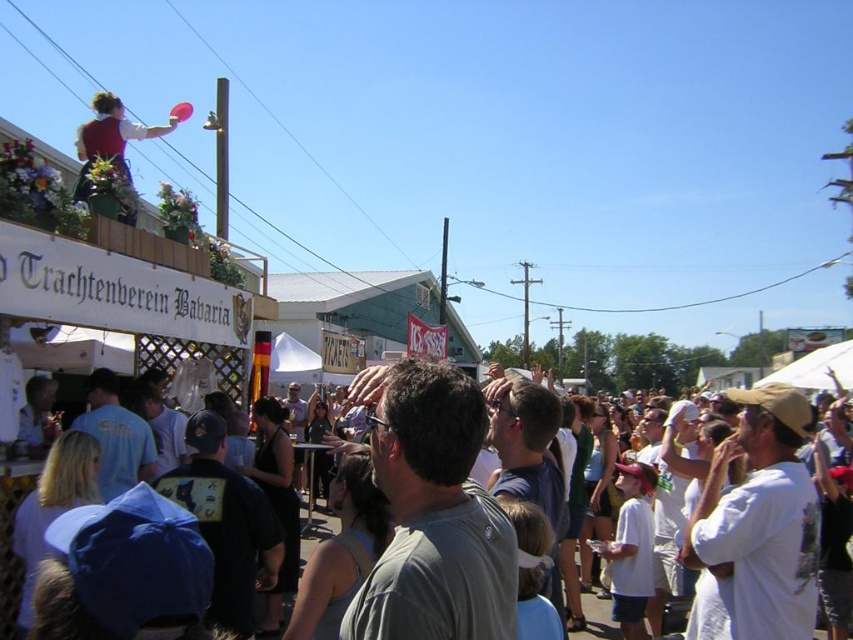
Based on the photo, is gray matte shirt at center wider than matte red vest at upper left?

In fact, gray matte shirt at center might be narrower than matte red vest at upper left.

Does gray matte shirt at center appear over matte red vest at upper left?

No, gray matte shirt at center is not above matte red vest at upper left.

Locate an element on the screen. gray matte shirt at center is located at coordinates (432, 513).

Does gray matte shirt at center have a lesser height compared to white cotton crowd at center?

Correct, gray matte shirt at center is not as tall as white cotton crowd at center.

Can you confirm if gray matte shirt at center is taller than white cotton crowd at center?

No, gray matte shirt at center is not taller than white cotton crowd at center.

Which is behind, point (428, 596) or point (370, 392)?

The point (370, 392) is more distant.

This screenshot has width=853, height=640. In order to click on gray matte shirt at center in this screenshot , I will do `click(432, 513)`.

Is matte red vest at upper left above white cotton crowd at center?

Yes, matte red vest at upper left is above white cotton crowd at center.

Which is more to the left, matte red vest at upper left or white cotton crowd at center?

matte red vest at upper left

The height and width of the screenshot is (640, 853). I want to click on matte red vest at upper left, so click(109, 138).